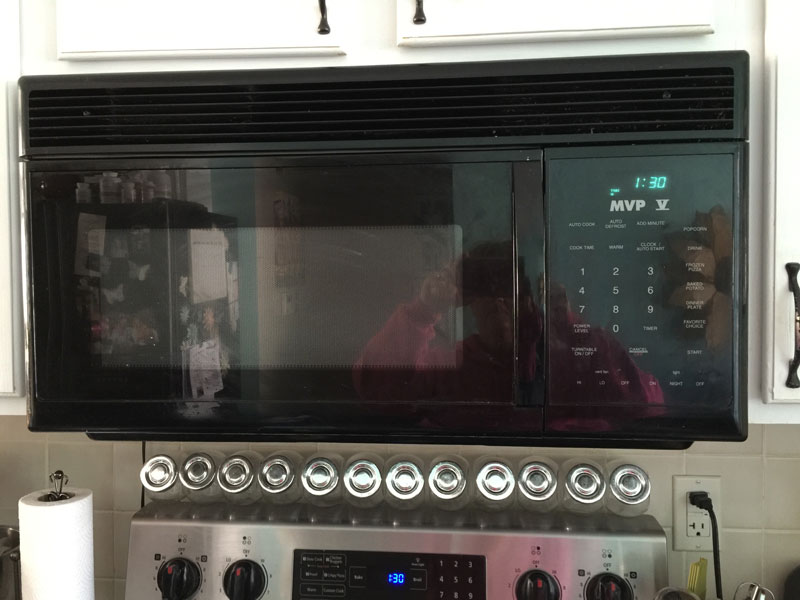
Where is `black cord`? black cord is located at coordinates (716, 557).